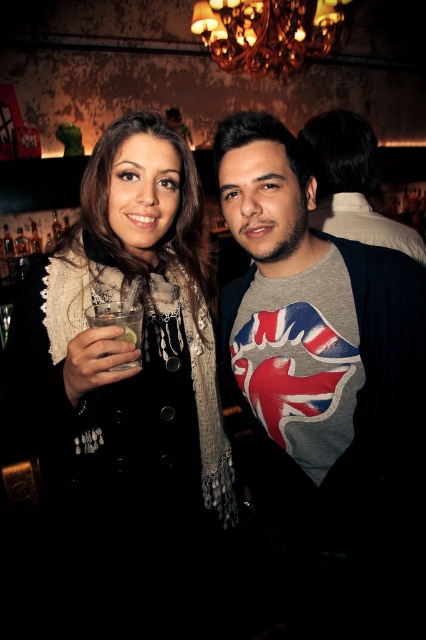
You are a photographer standing in front of the two people in the image. You want to take a photo that focuses on the matte black coat at center without the clear glass at left appearing in the foreground. Is this possible based on their positions?

The matte black coat at center is closer to the viewer than the clear glass at left, so yes, the photographer can focus on the matte black coat at center without the clear glass at left appearing in the foreground because the coat is in front of the glass.

You are standing in the bar and want to take a photo of both individuals. To ensure both are in frame, should you position yourself closer to point (x=140, y=353) or point (x=178, y=394)?

You should position yourself closer to point (x=140, y=353) because point (x=178, y=394) is behind it, so moving closer to the front point will keep both in frame.

You are a photographer setting up a shot in this bar scene. You need to focus on the gray fabric shirt at center and the clear glass at left. Which object should you adjust your focus on first if you want to ensure the taller object is in sharp focus?

The gray fabric shirt at center is taller than the clear glass at left, so you should focus on the gray fabric shirt at center first to ensure it is in sharp focus.